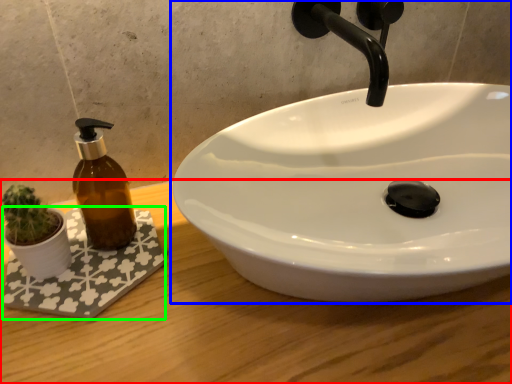
Question: Considering the real-world distances, which object is closest to counter top (highlighted by a red box)? sink (highlighted by a blue box) or bath mat (highlighted by a green box).

Choices:
 (A) sink
 (B) bath mat

Answer: (B)